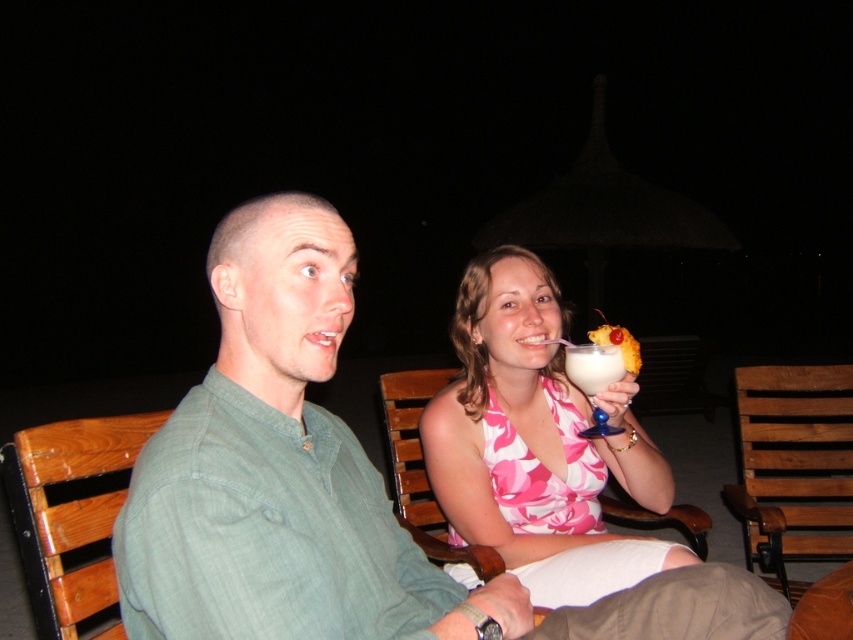
You are a photographer trying to capture a closeup shot of both the green matte shirt at center and the pink floral dress at center. Given that your camera can only focus on objects within a 15 inch range, will you need to adjust your position to ensure both are in focus?

The green matte shirt at center is 19.53 inches away from the pink floral dress at center. Since the camera can only focus within a 15 inch range, you will need to adjust your position to ensure both are in focus.

You are standing in front of the thatched roof structure and want to walk towards the two people sitting on the wooden benches. Which point, point (181, 477) or point (428, 435), will you reach first?

Point (181, 477) is closer to the viewer than point (428, 435), so you will reach point (181, 477) first.

You are a photographer adjusting camera settings for a night portrait. You notice the green matte shirt at center and the white frothy drink at upper center. Which object should you focus on first if you want to ensure the taller one is in sharp focus?

The green matte shirt at center is taller than the white frothy drink at upper center, so you should focus on the green matte shirt at center first to ensure it is in sharp focus.